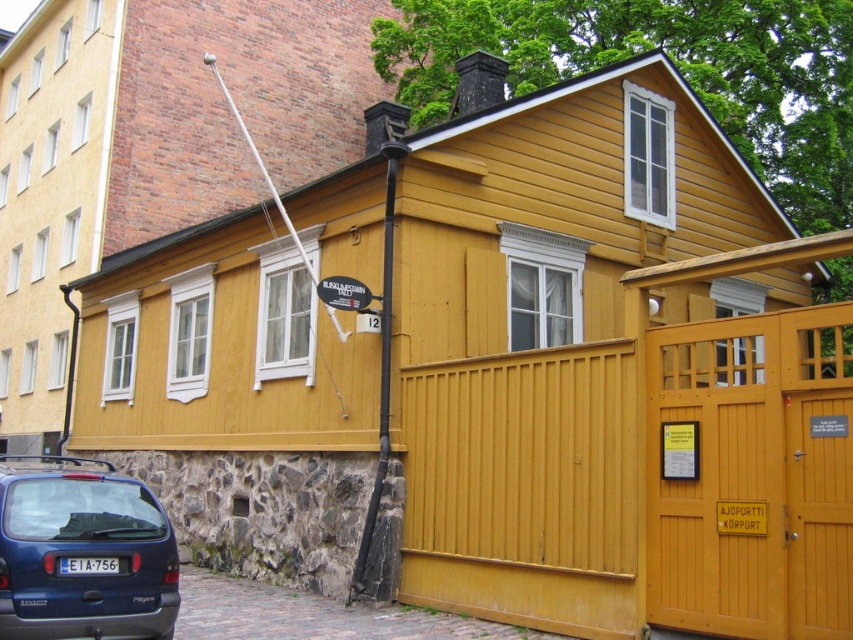
Question: Can you confirm if matte blue hatchback at lower left is positioned to the right of black metal pole at center?

Choices:
 (A) yes
 (B) no

Answer: (B)

Question: Which point appears farthest from the camera in this image?

Choices:
 (A) (384, 451)
 (B) (125, 486)

Answer: (A)

Question: Is matte blue hatchback at lower left bigger than black metal pole at center?

Choices:
 (A) yes
 (B) no

Answer: (A)

Question: Can you confirm if matte blue hatchback at lower left is positioned below black metal pole at center?

Choices:
 (A) yes
 (B) no

Answer: (A)

Question: Which of the following is the farthest from the observer?

Choices:
 (A) matte blue hatchback at lower left
 (B) black metal pole at center

Answer: (B)